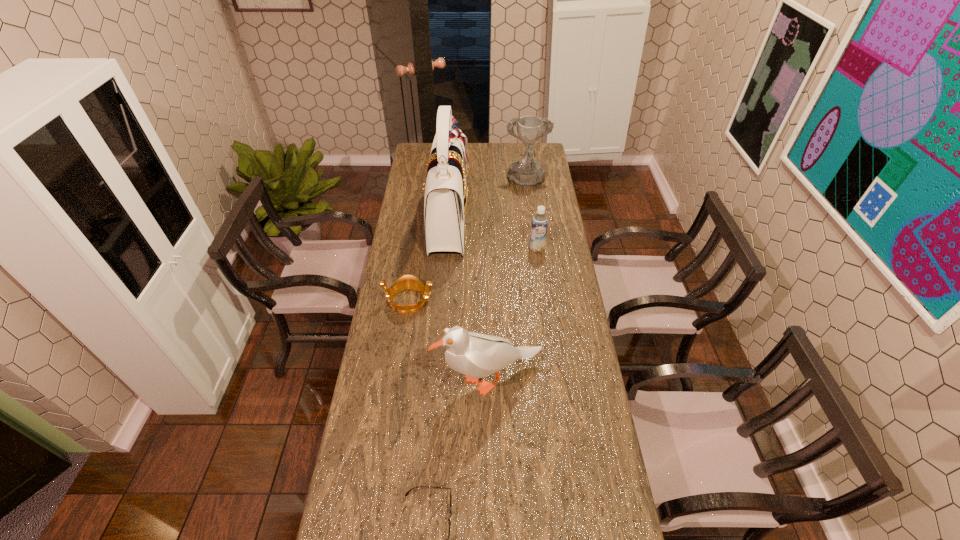
At what (x,y) coordinates should I click in order to perform the action: click on free space that satisfies the following two spatial constraints: 1. on the label of the fourth tallest object; 2. at the beak of the second nearest object. Please return your answer as a coordinate pair (x, y). Image resolution: width=960 pixels, height=540 pixels. Looking at the image, I should click on [554, 380].